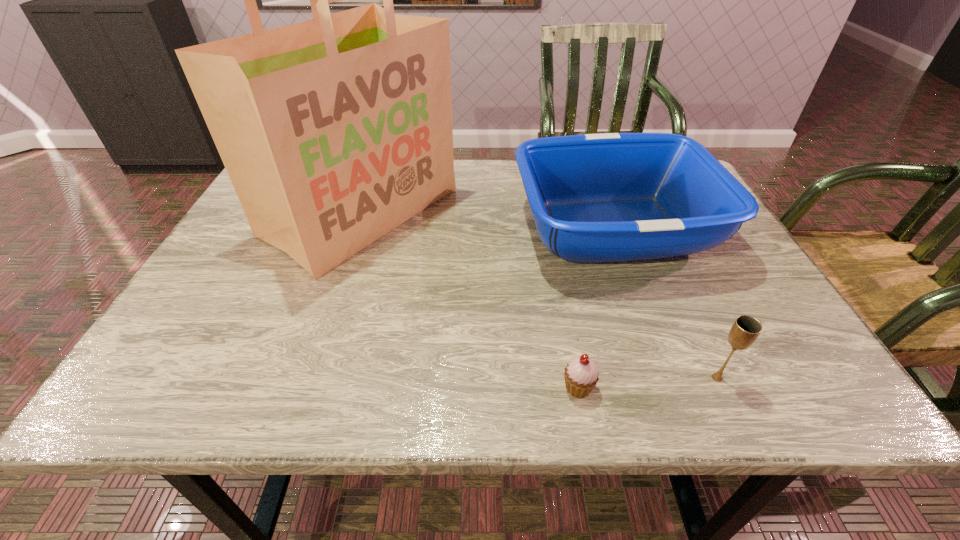
Where is `tray situated at the far edge`? tray situated at the far edge is located at coordinates (614, 197).

The width and height of the screenshot is (960, 540). I want to click on chalice that is at the near edge, so click(x=744, y=332).

Locate an element on the screen. cupcake at the near edge is located at coordinates [581, 375].

Find the location of `object present at the left edge`. object present at the left edge is located at coordinates click(334, 131).

Where is `object present at the right edge`? This screenshot has width=960, height=540. object present at the right edge is located at coordinates (614, 197).

Find the location of a particular element. The image size is (960, 540). object that is at the far left corner is located at coordinates (334, 131).

Find the location of a particular element. The image size is (960, 540). object at the far right corner is located at coordinates (614, 197).

This screenshot has height=540, width=960. I want to click on vacant position at the far edge of the desktop, so click(516, 204).

Locate an element on the screen. vacant space at the near edge of the desktop is located at coordinates (605, 396).

At what (x,y) coordinates should I click in order to perform the action: click on free region at the left edge. Please return your answer as a coordinate pair (x, y). The image size is (960, 540). Looking at the image, I should click on (x=198, y=310).